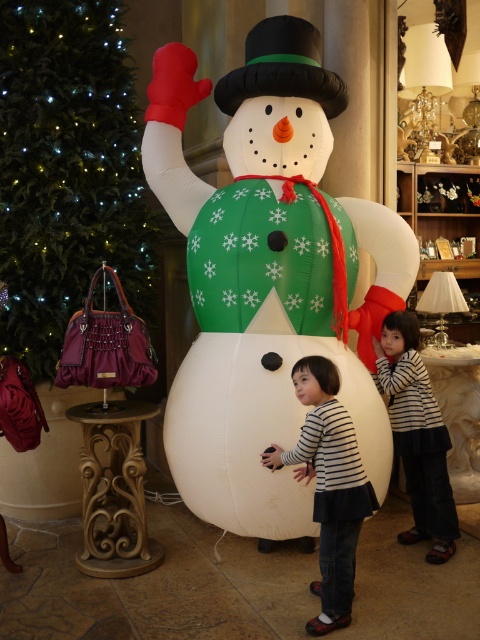
You are a photographer setting up for a family photo in this festive scene. You need to position the camera so that the striped fabric shirt at center is clearly visible without the green fabric christmas tree at upper left blocking it. Which direction should you move the camera to achieve this?

Move the camera to the right so that the striped fabric shirt at center is no longer blocked by the green fabric christmas tree at upper left, which is to the left of it.

You are a parent trying to ensure your child can safely interact with the inflatable white snowman at center and the striped fabric shirt at center. Based on their sizes, which object is more likely to be stable and less likely to tip over?

The inflatable white snowman at center is taller than the striped fabric shirt at center, so it has a lower center of gravity and is more stable, making it less likely to tip over.

You are standing in the festive indoor setting and want to place a new decoration exactly at the position where the green fabric christmas tree at upper left is located. What are the coordinates of that location?

The coordinates of the green fabric christmas tree at upper left are at point (68, 172).